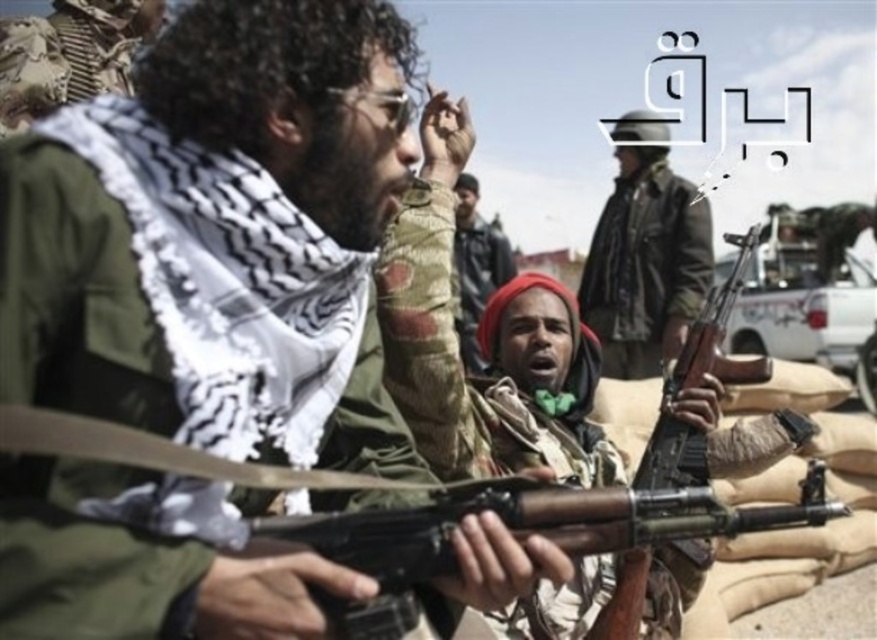
Is matte black helmet at upper center above camouflage-patterned uniform at center?

Correct, matte black helmet at upper center is located above camouflage-patterned uniform at center.

Which is more to the right, matte black helmet at upper center or camouflage-patterned uniform at center?

From the viewer's perspective, matte black helmet at upper center appears more on the right side.

Is point (646, 136) positioned in front of point (474, 209)?

Yes, it is.

Where is `matte black helmet at upper center`? This screenshot has height=640, width=877. matte black helmet at upper center is located at coordinates (645, 253).